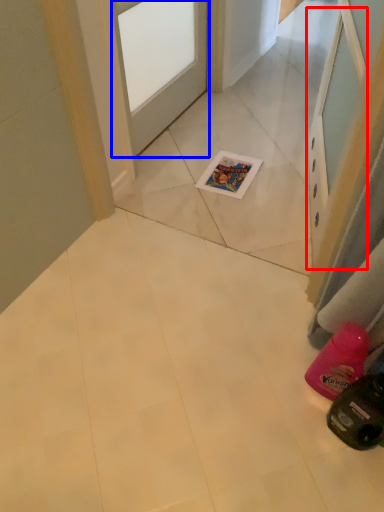
Question: Which object is further to the camera taking this photo, screen door (highlighted by a red box) or door (highlighted by a blue box)?

Choices:
 (A) screen door
 (B) door

Answer: (B)